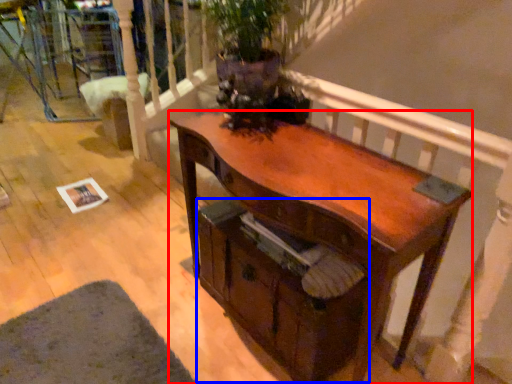
Question: Which object is further to the camera taking this photo, desk (highlighted by a red box) or drawer (highlighted by a blue box)?

Choices:
 (A) desk
 (B) drawer

Answer: (B)